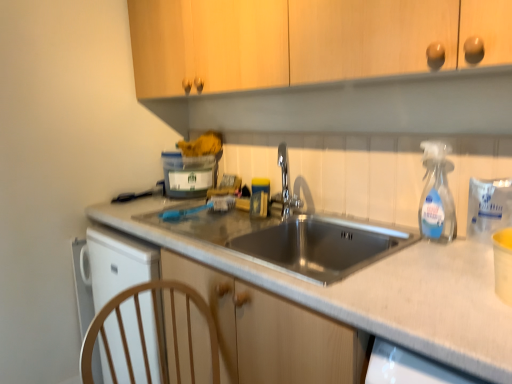
Question: Is chrome metallic faucet at center taller or shorter than metallic gray sink at center?

Choices:
 (A) short
 (B) tall

Answer: (A)

Question: From the image's perspective, is chrome metallic faucet at center positioned above or below metallic gray sink at center?

Choices:
 (A) above
 (B) below

Answer: (A)

Question: Based on their relative distances, which object is nearer to the chrome metallic faucet at center?

Choices:
 (A) clear plastic spray bottle at right
 (B) translucent plastic container at upper center
 (C) metallic gray sink at center

Answer: (B)

Question: Estimate the real-world distances between objects in this image. Which object is farther from the metallic gray sink at center?

Choices:
 (A) chrome metallic faucet at center
 (B) translucent plastic container at upper center
 (C) clear plastic spray bottle at right

Answer: (B)